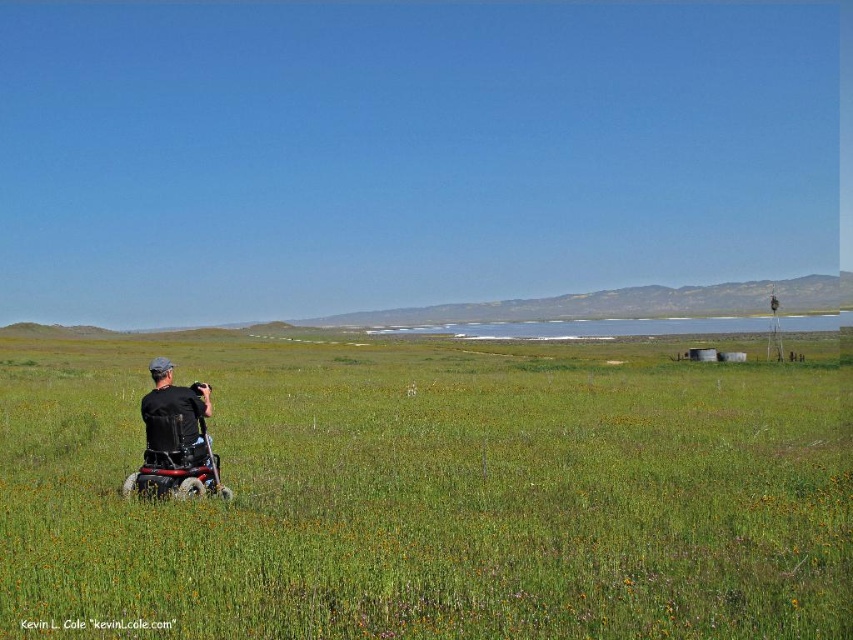
You are standing at the camera position. Which direction should you walk to reach the green grassy field at center?

The green grassy field at center is located at point coordinates of [431,493]. Since the person in the wheelchair is facing away from the camera towards the horizon, the field is likely in front of them, so you should walk forward to reach it.

You are a photographer trying to capture the entire green grassy field at center and black matte wheelchair at lower left in one frame. Given that your camera has a limited field of view, which object should you position closer to the camera to ensure both are fully visible?

Since the green grassy field at center is larger in size than the black matte wheelchair at lower left, you should position the black matte wheelchair at lower left closer to the camera to ensure both objects fit within the frame.

You are a photographer planning to set up a tripod in the green grassy field at center and the black matte wheelchair at lower left. Which location would allow the tripod to be more visible against the background?

The black matte wheelchair at lower left is taller than the green grassy field at center, so placing the tripod there would make it more visible against the background.